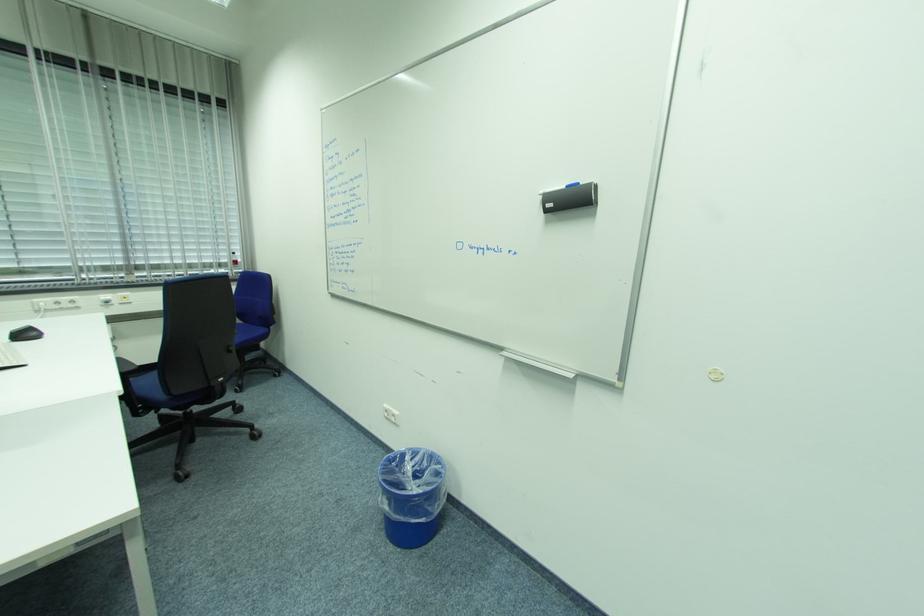
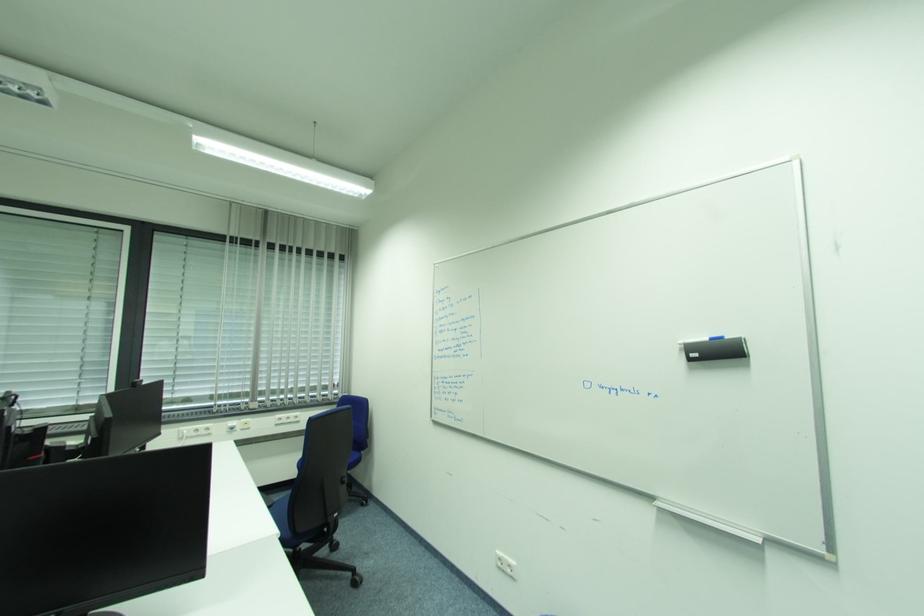
Question: The first image is from the beginning of the video and the second image is from the end. How did the camera likely rotate when shooting the video?

Choices:
 (A) Left
 (B) Right
 (C) Up
 (D) Down

Answer: (C)